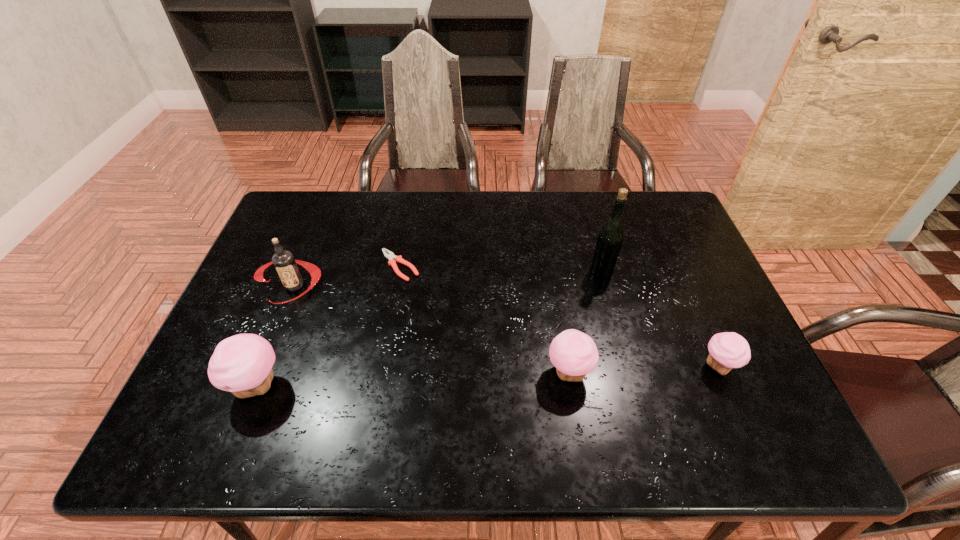
Find the location of a particular element. object that is at the near right corner is located at coordinates (728, 350).

Locate an element on the screen. The width and height of the screenshot is (960, 540). vacant space at the far edge of the desktop is located at coordinates (453, 190).

At what (x,y) coordinates should I click in order to perform the action: click on blank area at the near edge. Please return your answer as a coordinate pair (x, y). Looking at the image, I should click on click(383, 398).

This screenshot has height=540, width=960. Find the location of `vacant space at the right edge`. vacant space at the right edge is located at coordinates coord(673,296).

This screenshot has height=540, width=960. I want to click on free space at the far left corner of the desktop, so click(312, 223).

The height and width of the screenshot is (540, 960). What are the coordinates of `free space at the far right corner of the desktop` in the screenshot? It's located at (636, 197).

Locate an element on the screen. Image resolution: width=960 pixels, height=540 pixels. empty location between the tallest cupcake and the shortest object is located at coordinates (328, 326).

You are a GUI agent. You are given a task and a screenshot of the screen. Output one action in this format:
    pyautogui.click(x=<x>, y=<y>)
    Task: Click on the unoccupied position between the root beer and the tallest cupcake
    
    Given the screenshot: What is the action you would take?
    pyautogui.click(x=276, y=336)

Where is `blank region between the leftmost cupcake and the third object from left to right`? This screenshot has height=540, width=960. blank region between the leftmost cupcake and the third object from left to right is located at coordinates (328, 326).

This screenshot has height=540, width=960. What are the coordinates of `vacant region between the fourth tallest object and the beer bottle` in the screenshot? It's located at (585, 322).